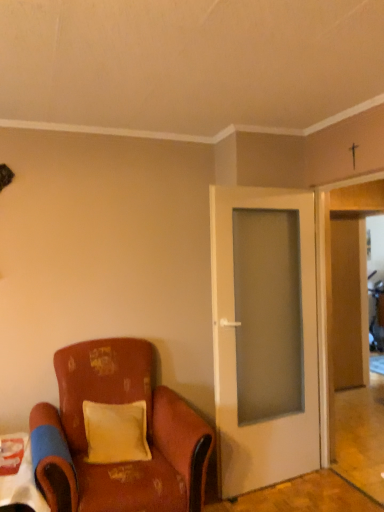
You are a GUI agent. You are given a task and a screenshot of the screen. Output one action in this format:
    pyautogui.click(x=<x>, y=<y>)
    Task: Click on the white glossy table at lower left
    The width and height of the screenshot is (384, 512).
    Given the screenshot: What is the action you would take?
    pyautogui.click(x=22, y=481)

In order to face wooden door at right, should I rotate leftwards or rightwards?

You should look right and rotate roughly 21.215 degrees.

Locate an element on the screen. Image resolution: width=384 pixels, height=512 pixels. white glass door at center is located at coordinates (235, 354).

This screenshot has height=512, width=384. In order to click on white glossy table at lower left in this screenshot , I will do `click(22, 481)`.

Is white glossy table at lower left at the back of yellow velvet pillow at center?

No, yellow velvet pillow at center's orientation is not away from white glossy table at lower left.

Would you say yellow velvet pillow at center is outside white glossy table at lower left?

Indeed, yellow velvet pillow at center is completely outside white glossy table at lower left.

Is the depth of yellow velvet pillow at center less than that of white glossy table at lower left?

No, it is behind white glossy table at lower left.

Locate an element on the screen. pillow above the white glossy table at lower left (from the image's perspective) is located at coordinates (116, 432).

Considering the positions of objects wooden door at right and white glossy table at lower left in the image provided, who is more to the right, wooden door at right or white glossy table at lower left?

Positioned to the right is wooden door at right.

Considering the sizes of wooden door at right and white glossy table at lower left in the image, is wooden door at right bigger or smaller than white glossy table at lower left?

Clearly, wooden door at right is larger in size than white glossy table at lower left.

Are wooden door at right and white glossy table at lower left making contact?

No, wooden door at right is not next to white glossy table at lower left.

Does wooden door at right have a greater height compared to white glossy table at lower left?

Indeed, wooden door at right has a greater height compared to white glossy table at lower left.

Which of these two, white glossy table at lower left or yellow velvet pillow at center, stands shorter?

With less height is white glossy table at lower left.

From a real-world perspective, between white glossy table at lower left and yellow velvet pillow at center, who is vertically lower?

white glossy table at lower left.

Identify the location of pillow above the white glossy table at lower left (from the image's perspective). (116, 432).

Is white glossy table at lower left directly adjacent to yellow velvet pillow at center?

No, white glossy table at lower left is not making contact with yellow velvet pillow at center.

In terms of size, does white glass door at center appear bigger or smaller than yellow velvet pillow at center?

white glass door at center is bigger than yellow velvet pillow at center.

Which is more to the left, white glass door at center or yellow velvet pillow at center?

yellow velvet pillow at center.

The width and height of the screenshot is (384, 512). Identify the location of pillow on the left of white glass door at center. (116, 432).

Can you see white glass door at center touching yellow velvet pillow at center?

No, white glass door at center is not making contact with yellow velvet pillow at center.

Which object is wider, white glossy table at lower left or wooden door at right?

With larger width is white glossy table at lower left.

Are white glossy table at lower left and wooden door at right far apart?

That's right, there is a large distance between white glossy table at lower left and wooden door at right.

Identify the location of garage door behind the white glossy table at lower left. This screenshot has width=384, height=512. (342, 287).

Looking at this image, is white glossy table at lower left not inside wooden door at right?

Absolutely, white glossy table at lower left is external to wooden door at right.

Is distressed leather chair at lower left aimed at yellow velvet pillow at center?

Yes, distressed leather chair at lower left is oriented towards yellow velvet pillow at center.

Based on the photo, considering the sizes of distressed leather chair at lower left and yellow velvet pillow at center in the image, is distressed leather chair at lower left taller or shorter than yellow velvet pillow at center?

Clearly, distressed leather chair at lower left is taller compared to yellow velvet pillow at center.

Could yellow velvet pillow at center be considered to be inside distressed leather chair at lower left?

Indeed, yellow velvet pillow at center is located within distressed leather chair at lower left.

Can you see distressed leather chair at lower left touching yellow velvet pillow at center?

distressed leather chair at lower left is not next to yellow velvet pillow at center, and they're not touching.

From a real-world perspective, which is physically above, yellow velvet pillow at center or distressed leather chair at lower left?

In real-world perspective, yellow velvet pillow at center is above.

Considering the sizes of objects yellow velvet pillow at center and distressed leather chair at lower left in the image provided, who is thinner, yellow velvet pillow at center or distressed leather chair at lower left?

Thinner between the two is yellow velvet pillow at center.

How much distance is there between yellow velvet pillow at center and distressed leather chair at lower left?

The distance of yellow velvet pillow at center from distressed leather chair at lower left is 6.84 inches.

At what (x,y) coordinates should I click in order to perform the action: click on chair below the yellow velvet pillow at center (from the image's perspective). Please return your answer as a coordinate pair (x, y). Looking at the image, I should click on (147, 434).

This screenshot has width=384, height=512. I want to click on table on the left of yellow velvet pillow at center, so click(22, 481).

Image resolution: width=384 pixels, height=512 pixels. I want to click on garage door behind the white glossy table at lower left, so point(342,287).

Based on their spatial positions, is white glass door at center or yellow velvet pillow at center closer to distressed leather chair at lower left?

yellow velvet pillow at center is closer to distressed leather chair at lower left.

Considering their positions, is white glossy table at lower left positioned closer to yellow velvet pillow at center than wooden door at right?

Based on the image, white glossy table at lower left appears to be nearer to yellow velvet pillow at center.

When comparing their distances from wooden door at right, does white glossy table at lower left or white glass door at center seem further?

white glossy table at lower left is further to wooden door at right.

Which object lies further to the anchor point white glossy table at lower left, yellow velvet pillow at center or white glass door at center?

The object further to white glossy table at lower left is white glass door at center.

Based on their spatial positions, is distressed leather chair at lower left or white glossy table at lower left further from wooden door at right?

white glossy table at lower left is positioned further to the anchor wooden door at right.

When comparing their distances from wooden door at right, does white glass door at center or yellow velvet pillow at center seem further?

yellow velvet pillow at center.

Which object lies further to the anchor point white glass door at center, yellow velvet pillow at center or white glossy table at lower left?

white glossy table at lower left lies further to white glass door at center than the other object.

Considering their positions, is distressed leather chair at lower left positioned further to white glass door at center than white glossy table at lower left?

white glossy table at lower left is positioned further to the anchor white glass door at center.

Image resolution: width=384 pixels, height=512 pixels. In order to click on chair between white glossy table at lower left and yellow velvet pillow at center from front to back in this screenshot , I will do `click(147, 434)`.

I want to click on chair between yellow velvet pillow at center and wooden door at right in the horizontal direction, so click(147, 434).

Where is `door situated between distressed leather chair at lower left and wooden door at right from left to right`? The image size is (384, 512). door situated between distressed leather chair at lower left and wooden door at right from left to right is located at coordinates (235, 354).

Locate an element on the screen. chair between white glossy table at lower left and white glass door at center is located at coordinates (147, 434).